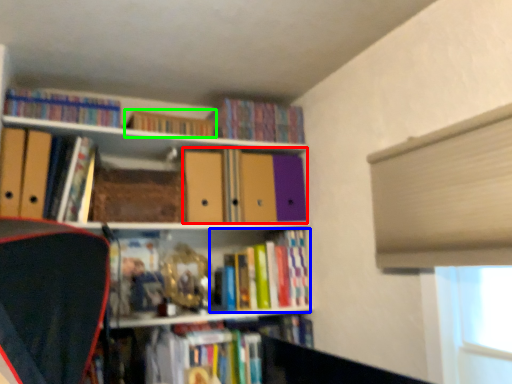
Question: Based on their relative distances, which object is farther from book (highlighted by a red box)? Choose from book (highlighted by a blue box) and book (highlighted by a green box).

Choices:
 (A) book
 (B) book

Answer: (B)